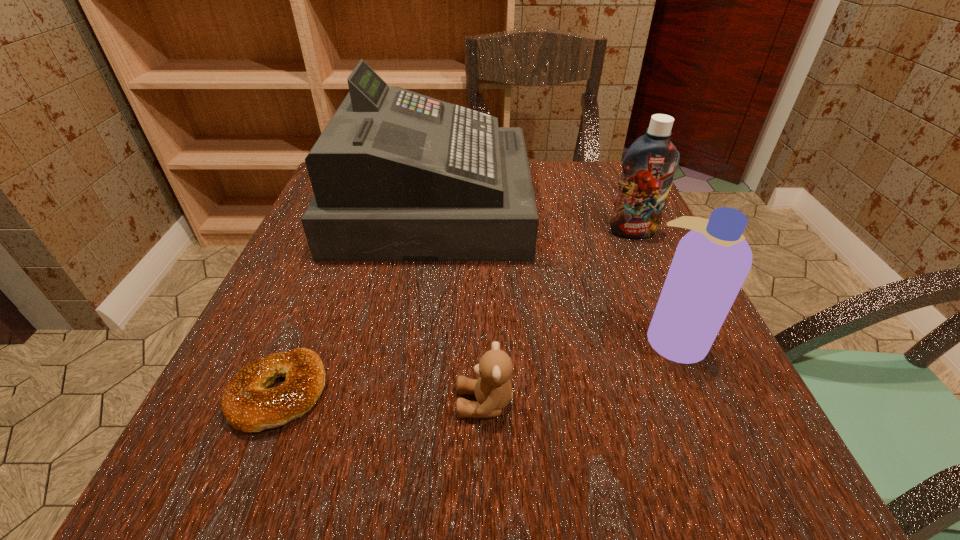
Find the location of a particular element. vacant area that lies between the farther shampoo and the nearer shampoo is located at coordinates (653, 285).

Where is `vacant point located between the cash register and the teddy bear`? Image resolution: width=960 pixels, height=540 pixels. vacant point located between the cash register and the teddy bear is located at coordinates [x=459, y=305].

This screenshot has height=540, width=960. What are the coordinates of `vacant area that lies between the nearer shampoo and the teddy bear` in the screenshot? It's located at pyautogui.click(x=579, y=370).

Locate which object ranks third in proximity to the shortest object. Please provide its 2D coordinates. Your answer should be formatted as a tuple, i.e. [(x, y)], where the tuple contains the x and y coordinates of a point satisfying the conditions above.

[(711, 262)]

Point out which object is positioned as the fourth nearest to the fourth tallest object. Please provide its 2D coordinates. Your answer should be formatted as a tuple, i.e. [(x, y)], where the tuple contains the x and y coordinates of a point satisfying the conditions above.

[(649, 165)]

Identify the location of vacant point that satisfies the following two spatial constraints: 1. on the back side of the nearer shampoo; 2. on the left side of the bagel. [x=301, y=338].

You are a GUI agent. You are given a task and a screenshot of the screen. Output one action in this format:
    pyautogui.click(x=<x>, y=<y>)
    Task: Click on the free space in the image that satisfies the following two spatial constraints: 1. on the front-facing side of the cash register; 2. on the left side of the nearer shampoo
    The height and width of the screenshot is (540, 960).
    Given the screenshot: What is the action you would take?
    pyautogui.click(x=413, y=338)

At what (x,y) coordinates should I click in order to perform the action: click on free location that satisfies the following two spatial constraints: 1. on the back side of the shortest object; 2. on the left side of the nearer shampoo. Please return your answer as a coordinate pair (x, y). This screenshot has height=540, width=960. Looking at the image, I should click on (301, 338).

The width and height of the screenshot is (960, 540). I want to click on free space that satisfies the following two spatial constraints: 1. on the front label of the farther shampoo; 2. on the face of the fourth tallest object, so click(x=709, y=403).

Where is `vacant position in the image that satisfies the following two spatial constraints: 1. on the back side of the nearer shampoo; 2. on the right side of the shortest object`? vacant position in the image that satisfies the following two spatial constraints: 1. on the back side of the nearer shampoo; 2. on the right side of the shortest object is located at coordinates (301, 338).